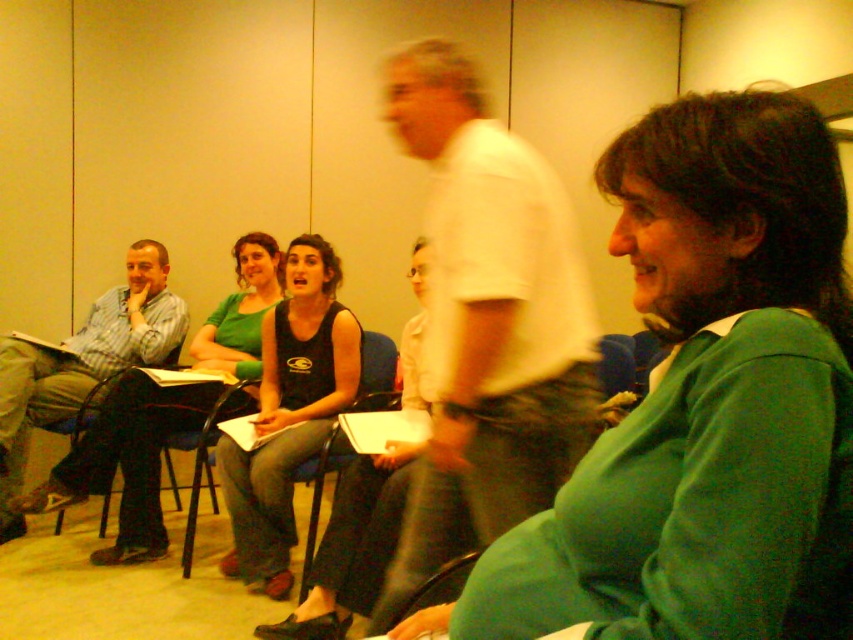
Which is in front, point (434, 444) or point (334, 435)?

Positioned in front is point (434, 444).

Is white matte shirt at center shorter than black fabric chair at center?

Incorrect, white matte shirt at center's height does not fall short of black fabric chair at center's.

Locate an element on the screen. This screenshot has height=640, width=853. white matte shirt at center is located at coordinates (488, 323).

Who is higher up, striped cotton shirt at left or black fabric chair at center?

Positioned higher is striped cotton shirt at left.

Does striped cotton shirt at left have a smaller size compared to black fabric chair at center?

No, striped cotton shirt at left is not smaller than black fabric chair at center.

Is point (1, 400) positioned in front of point (381, 339)?

Yes, point (1, 400) is closer to viewer.

At what (x,y) coordinates should I click in order to perform the action: click on striped cotton shirt at left. Please return your answer as a coordinate pair (x, y). This screenshot has width=853, height=640. Looking at the image, I should click on (82, 362).

Is white matte shirt at center behind black tank top at center?

No, white matte shirt at center is in front of black tank top at center.

Who is more forward, (402, 131) or (271, 528)?

Point (402, 131) is more forward.

Locate an element on the screen. Image resolution: width=853 pixels, height=640 pixels. white matte shirt at center is located at coordinates (488, 323).